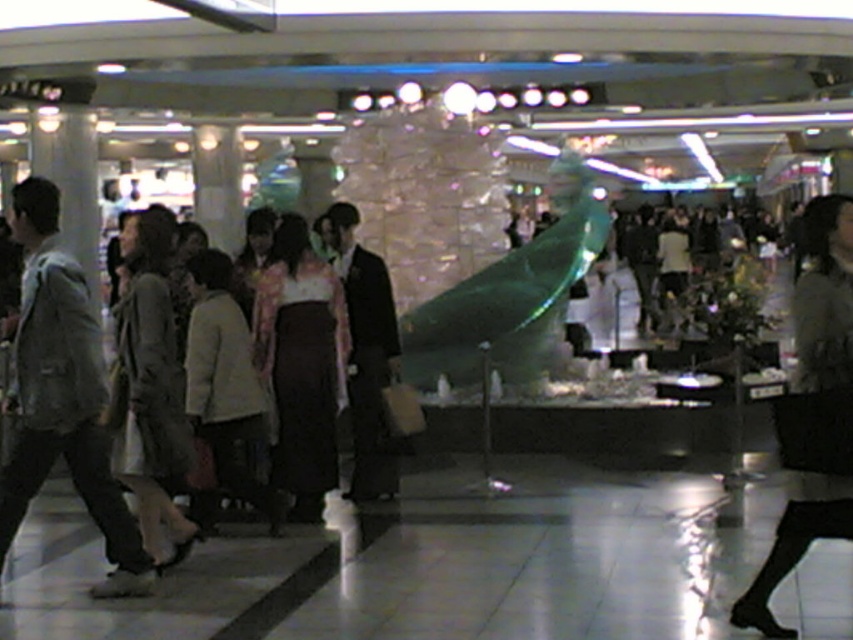
Question: Is light beige coat at center wider than light beige fabric coat at center?

Choices:
 (A) no
 (B) yes

Answer: (A)

Question: Which object appears farthest from the camera in this image?

Choices:
 (A) light beige coat at center
 (B) light beige fabric coat at center
 (C) floral kimono at center

Answer: (C)

Question: Estimate the real-world distances between objects in this image. Which object is closer to the light beige fabric coat at center?

Choices:
 (A) light beige coat at center
 (B) floral kimono at center

Answer: (B)

Question: Which of the following is the closest to the observer?

Choices:
 (A) light beige coat at center
 (B) floral kimono at center

Answer: (A)

Question: Does floral kimono at center lie in front of light beige coat at center?

Choices:
 (A) no
 (B) yes

Answer: (A)

Question: Where is floral kimono at center located in relation to light beige coat at center in the image?

Choices:
 (A) left
 (B) right

Answer: (B)